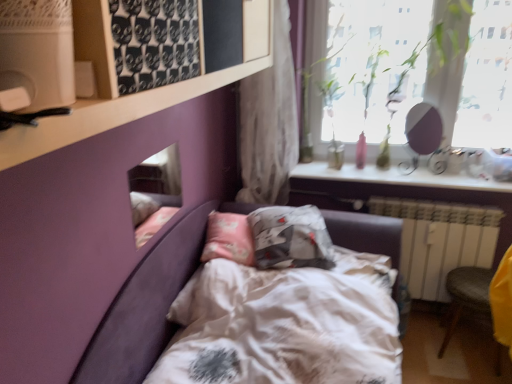
The width and height of the screenshot is (512, 384). I want to click on free space above white glossy shelf at upper right (from a real-world perspective), so click(395, 167).